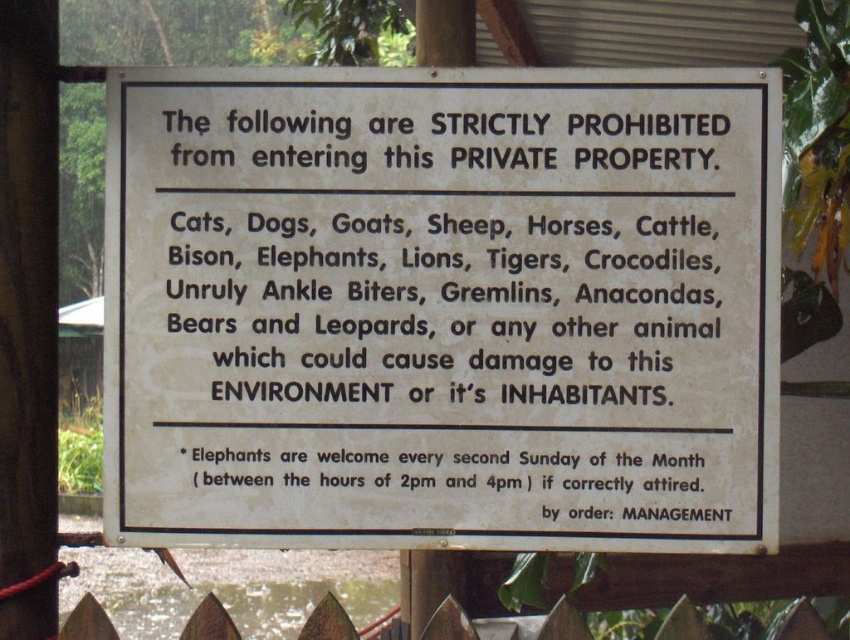
You are standing in front of the wooden post and want to place a new sign about prohibited animals. The existing white paper sign at center is already mounted. Where should you place your new sign so it doesn not overlap with the existing one?

The white paper sign at center is located at coordinates (442, 308). To avoid overlapping, place your new sign either to the left, right, above, or below this position.

You are a delivery person approaching the entrance of a property. You see a white paper sign at center and a wooden picket fence at lower center. Which object is narrower?

The white paper sign at center has a lesser width compared to the wooden picket fence at lower center, so the white paper sign at center is narrower.

You are a delivery person approaching the entrance of a property. You see a white paper sign at center and a wooden picket fence at lower center. Which object is positioned higher from the ground?

The white paper sign at center is located above the wooden picket fence at lower center, so it is positioned higher from the ground.